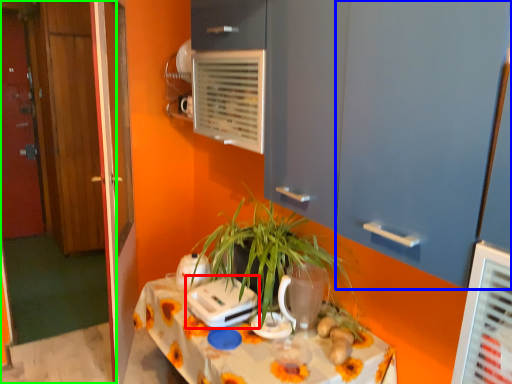
Question: Based on their relative distances, which object is nearer to appliance (highlighted by a red box)? Choose from door (highlighted by a blue box) and door (highlighted by a green box).

Choices:
 (A) door
 (B) door

Answer: (A)